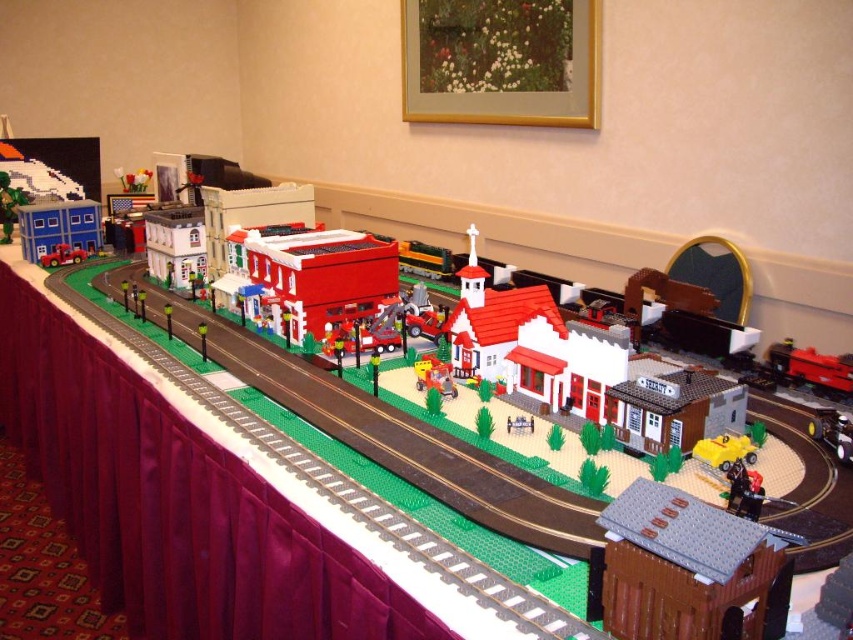
You are a visitor standing in front of the Lego train set. You notice the metallic red train at lower right and the matte black train car at left. Which train is positioned closer to you?

The metallic red train at lower right is closer to the viewer than the matte black train car at left.